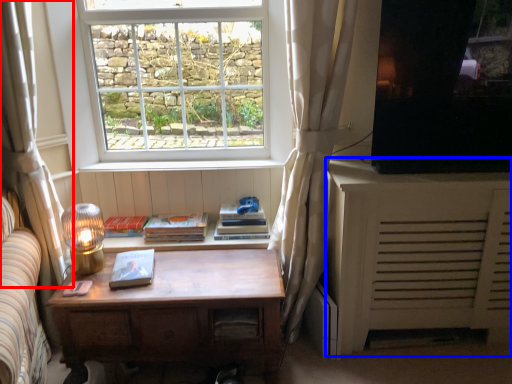
Question: Which of the following is the closest to the observer, curtain (highlighted by a red box) or cabinetry (highlighted by a blue box)?

Choices:
 (A) curtain
 (B) cabinetry

Answer: (A)